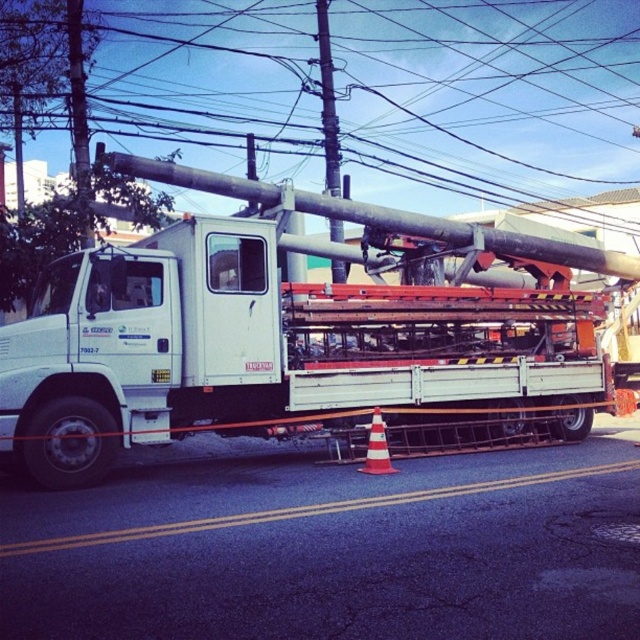
Question: Is white matte trailer truck at center below orange reflective traffic cone at lower center?

Choices:
 (A) no
 (B) yes

Answer: (A)

Question: Which point appears closest to the camera in this image?

Choices:
 (A) (380, 465)
 (B) (330, 97)
 (C) (582, 291)

Answer: (A)

Question: Which object is positioned farthest from the orange reflective traffic cone at lower center?

Choices:
 (A) brushed metal pole at center
 (B) white matte trailer truck at center

Answer: (A)

Question: Estimate the real-world distances between objects in this image. Which object is farther from the white matte trailer truck at center?

Choices:
 (A) brushed metal pole at center
 (B) orange reflective traffic cone at lower center

Answer: (A)

Question: Does white matte trailer truck at center appear on the left side of orange reflective traffic cone at lower center?

Choices:
 (A) no
 (B) yes

Answer: (A)

Question: Does white matte trailer truck at center have a lesser width compared to orange reflective traffic cone at lower center?

Choices:
 (A) yes
 (B) no

Answer: (B)